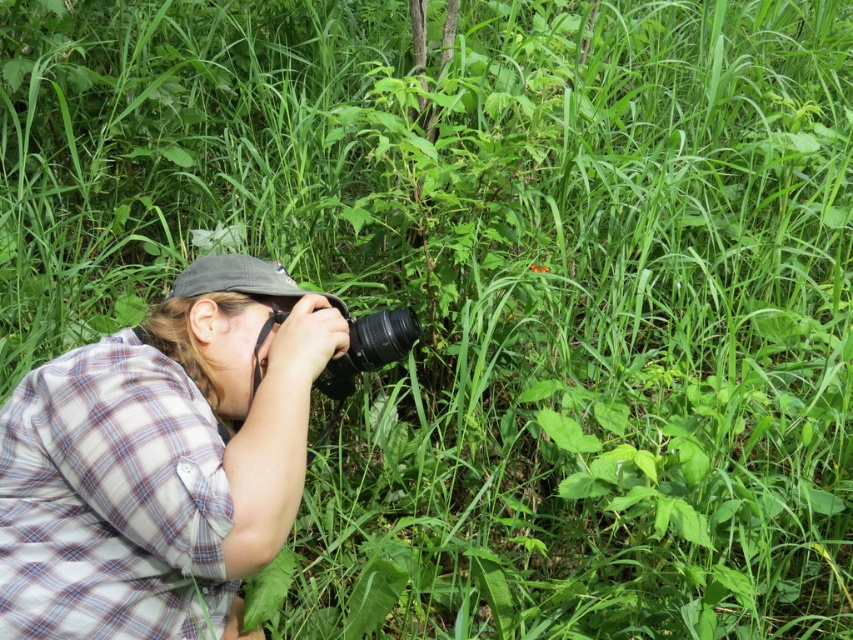
Question: Which point appears closest to the camera in this image?

Choices:
 (A) (305, 304)
 (B) (366, 356)

Answer: (A)

Question: Does plaid fabric shirt at left have a larger size compared to black plastic camera at center?

Choices:
 (A) no
 (B) yes

Answer: (B)

Question: Which object is farther from the camera taking this photo?

Choices:
 (A) plaid fabric shirt at left
 (B) black plastic camera at center

Answer: (B)

Question: Does plaid fabric shirt at left appear under black plastic camera at center?

Choices:
 (A) yes
 (B) no

Answer: (A)

Question: Considering the relative positions of plaid fabric shirt at left and black plastic camera at center in the image provided, where is plaid fabric shirt at left located with respect to black plastic camera at center?

Choices:
 (A) above
 (B) below

Answer: (B)

Question: Which of the following is the farthest from the observer?

Choices:
 (A) plaid fabric shirt at left
 (B) black plastic camera at center

Answer: (B)